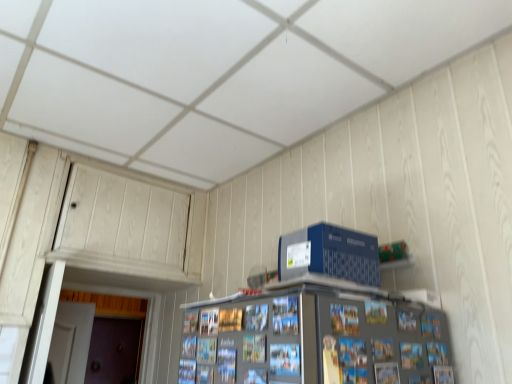
Question: Does brown matte door at lower left have a lesser width compared to blue plastic computer at upper right?

Choices:
 (A) yes
 (B) no

Answer: (A)

Question: From the image's perspective, would you say brown matte door at lower left is positioned over blue plastic computer at upper right?

Choices:
 (A) yes
 (B) no

Answer: (B)

Question: Is brown matte door at lower left not within blue plastic computer at upper right?

Choices:
 (A) yes
 (B) no

Answer: (A)

Question: Does brown matte door at lower left contain blue plastic computer at upper right?

Choices:
 (A) no
 (B) yes

Answer: (A)

Question: Is brown matte door at lower left at the right side of blue plastic computer at upper right?

Choices:
 (A) yes
 (B) no

Answer: (B)

Question: Does brown matte door at lower left have a larger size compared to blue plastic computer at upper right?

Choices:
 (A) yes
 (B) no

Answer: (A)

Question: From a real-world perspective, is blue plastic computer at upper right physically below brown matte door at lower left?

Choices:
 (A) no
 (B) yes

Answer: (A)

Question: From the image's perspective, is blue plastic computer at upper right located above brown matte door at lower left?

Choices:
 (A) no
 (B) yes

Answer: (B)

Question: Does blue plastic computer at upper right have a smaller size compared to brown matte door at lower left?

Choices:
 (A) yes
 (B) no

Answer: (A)

Question: Is blue plastic computer at upper right located outside brown matte door at lower left?

Choices:
 (A) no
 (B) yes

Answer: (B)

Question: Is blue plastic computer at upper right wider than brown matte door at lower left?

Choices:
 (A) no
 (B) yes

Answer: (B)

Question: Does blue plastic computer at upper right have a larger size compared to brown matte door at lower left?

Choices:
 (A) yes
 (B) no

Answer: (B)

Question: Considering the positions of brown matte door at lower left and blue plastic computer at upper right in the image, is brown matte door at lower left bigger or smaller than blue plastic computer at upper right?

Choices:
 (A) big
 (B) small

Answer: (A)